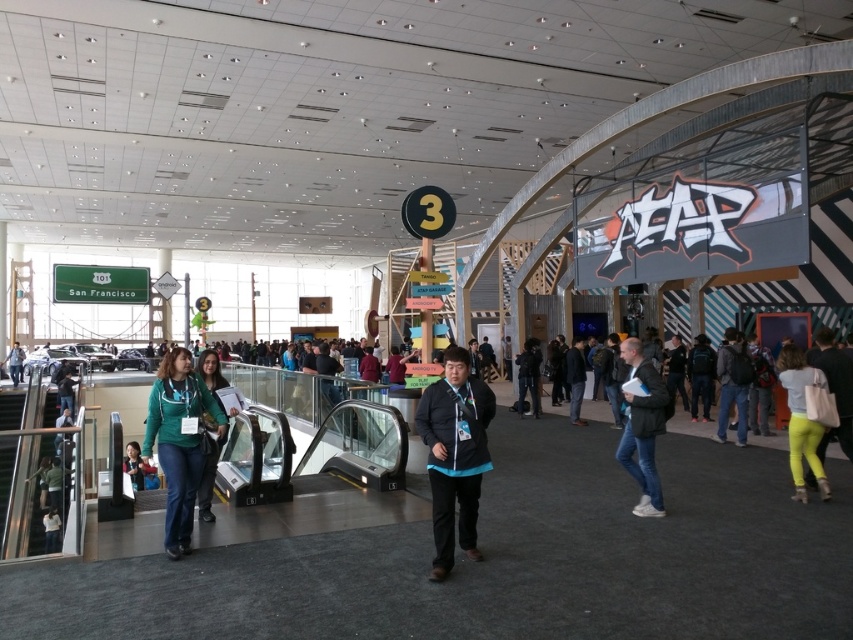
Question: Which point is closer to the camera?

Choices:
 (A) matte green jacket at lower left
 (B) dark gray backpack at right
 (C) white leather jacket at lower right
 (D) denim jacket at lower left

Answer: (C)

Question: Is light green pants at lower right to the left of matte green jacket at lower left from the viewer's perspective?

Choices:
 (A) yes
 (B) no

Answer: (B)

Question: Among these points, which one is nearest to the camera?

Choices:
 (A) (7, 365)
 (B) (741, 371)
 (C) (805, 442)

Answer: (C)

Question: Is black fabric jacket at center wider than green fabric jacket at center?

Choices:
 (A) no
 (B) yes

Answer: (A)

Question: Which of these objects is positioned farthest from the green fabric jacket at lower left?

Choices:
 (A) matte green jacket at lower left
 (B) white leather jacket at lower right
 (C) light green pants at lower right

Answer: (A)

Question: Does light green pants at lower right have a smaller size compared to green fabric jacket at center?

Choices:
 (A) no
 (B) yes

Answer: (B)